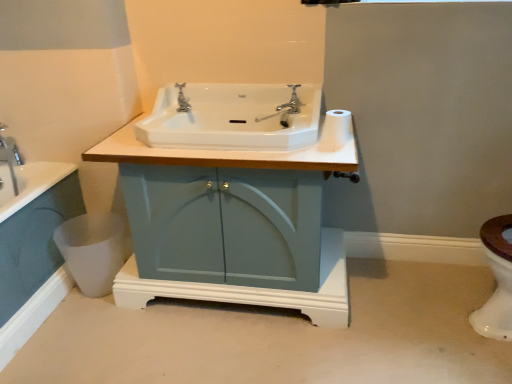
I want to click on vacant space in front of white glossy toilet bowl at lower right, so click(88, 315).